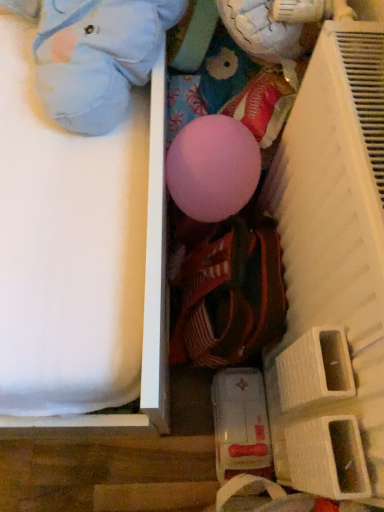
Question: From their relative heights in the image, would you say white plastic shelf at right is taller or shorter than light blue plush toy at upper left?

Choices:
 (A) short
 (B) tall

Answer: (B)

Question: Considering their positions, is white plastic shelf at right located in front of or behind light blue plush toy at upper left?

Choices:
 (A) front
 (B) behind

Answer: (A)

Question: Based on their positions, is white plastic shelf at right located to the left or right of light blue plush toy at upper left?

Choices:
 (A) left
 (B) right

Answer: (B)

Question: Is light blue plush toy at upper left in front of or behind white plastic shelf at right in the image?

Choices:
 (A) front
 (B) behind

Answer: (B)

Question: From their relative heights in the image, would you say light blue plush toy at upper left is taller or shorter than white plastic shelf at right?

Choices:
 (A) tall
 (B) short

Answer: (B)

Question: From a real-world perspective, is light blue plush toy at upper left physically located above or below white plastic shelf at right?

Choices:
 (A) below
 (B) above

Answer: (B)

Question: In the image, is light blue plush toy at upper left on the left side or the right side of white plastic shelf at right?

Choices:
 (A) left
 (B) right

Answer: (A)